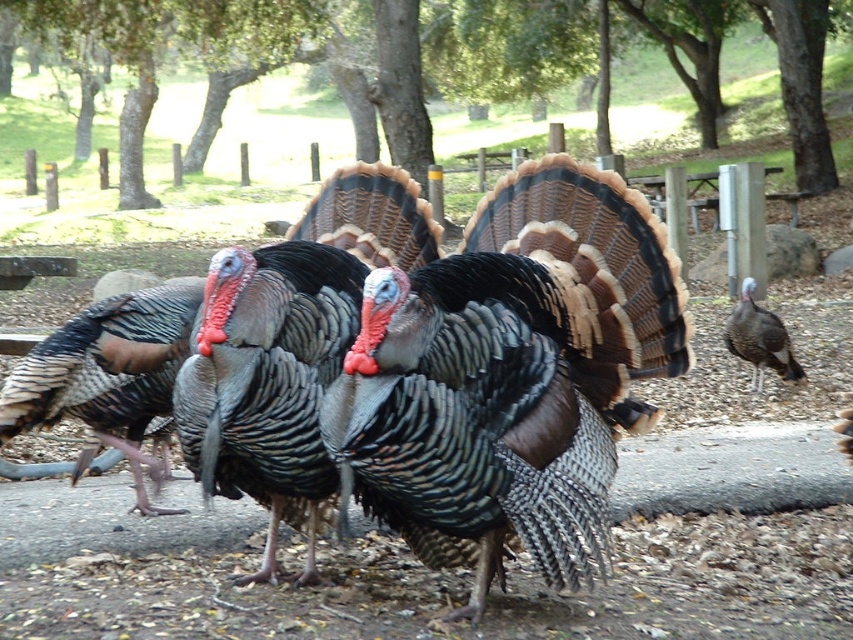
Question: Does shiny metallic turkey at center appear under gray feathered turkey at right?

Choices:
 (A) yes
 (B) no

Answer: (A)

Question: Which point is farther to the camera?

Choices:
 (A) (633, 406)
 (B) (798, 378)

Answer: (B)

Question: Can you confirm if shiny metallic turkey at center is thinner than gray feathered turkey at right?

Choices:
 (A) yes
 (B) no

Answer: (B)

Question: Does shiny metallic turkey at center lie behind gray feathered turkey at right?

Choices:
 (A) no
 (B) yes

Answer: (A)